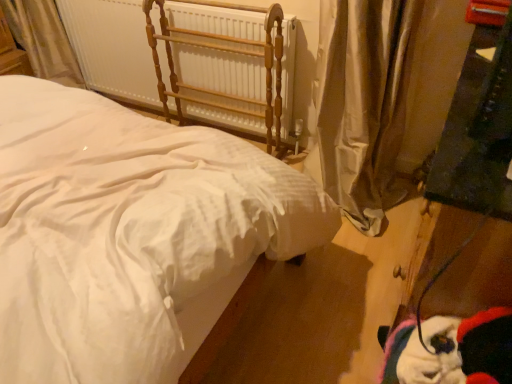
Question: Would you say silky beige curtain at right is outside white cotton bed at center?

Choices:
 (A) no
 (B) yes

Answer: (B)

Question: Is silky beige curtain at right at the right side of white cotton bed at center?

Choices:
 (A) yes
 (B) no

Answer: (A)

Question: Would you say silky beige curtain at right contains white cotton bed at center?

Choices:
 (A) no
 (B) yes

Answer: (A)

Question: From the image's perspective, is silky beige curtain at right under white cotton bed at center?

Choices:
 (A) no
 (B) yes

Answer: (A)

Question: Is silky beige curtain at right in contact with white cotton bed at center?

Choices:
 (A) yes
 (B) no

Answer: (B)

Question: Is white painted metal radiator at upper center bigger or smaller than silky beige curtain at right?

Choices:
 (A) big
 (B) small

Answer: (B)

Question: From the image's perspective, is white painted metal radiator at upper center positioned above or below silky beige curtain at right?

Choices:
 (A) below
 (B) above

Answer: (B)

Question: In terms of height, does white painted metal radiator at upper center look taller or shorter compared to silky beige curtain at right?

Choices:
 (A) short
 (B) tall

Answer: (A)

Question: From a real-world perspective, is white painted metal radiator at upper center physically located above or below silky beige curtain at right?

Choices:
 (A) above
 (B) below

Answer: (B)

Question: Relative to white cotton bed at center, is silky beige curtain at right in front or behind?

Choices:
 (A) behind
 (B) front

Answer: (A)

Question: Is silky beige curtain at right to the left or to the right of white cotton bed at center in the image?

Choices:
 (A) right
 (B) left

Answer: (A)

Question: Looking at the image, does silky beige curtain at right seem bigger or smaller compared to white cotton bed at center?

Choices:
 (A) small
 (B) big

Answer: (A)

Question: Looking at their shapes, would you say silky beige curtain at right is wider or thinner than white cotton bed at center?

Choices:
 (A) thin
 (B) wide

Answer: (A)

Question: From a real-world perspective, is white cotton bed at center positioned above or below silky beige curtain at right?

Choices:
 (A) below
 (B) above

Answer: (A)

Question: Would you say white cotton bed at center is inside or outside silky beige curtain at right?

Choices:
 (A) inside
 (B) outside

Answer: (B)